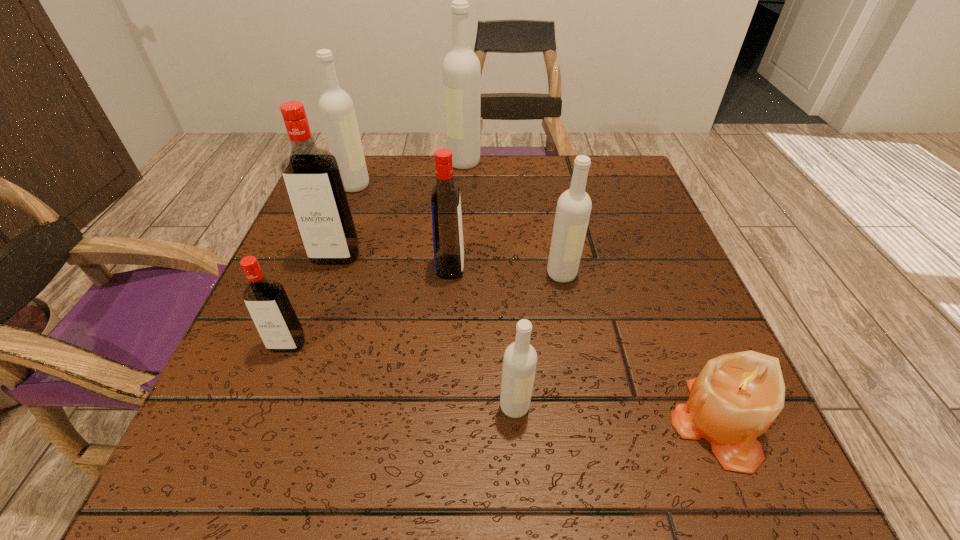
The width and height of the screenshot is (960, 540). Find the location of `empty space that is in between the tallest object and the rightmost object`. empty space that is in between the tallest object and the rightmost object is located at coordinates [x=590, y=292].

The width and height of the screenshot is (960, 540). What are the coordinates of `free space between the smallest white vodka and the third white vodka from right to left` in the screenshot? It's located at [x=490, y=285].

Identify which object is the second nearest to the rightmost white vodka. Please provide its 2D coordinates. Your answer should be formatted as a tuple, i.e. [(x, y)], where the tuple contains the x and y coordinates of a point satisfying the conditions above.

[(736, 397)]

I want to click on the sixth closest object to the sixth farthest object, so click(736, 397).

The width and height of the screenshot is (960, 540). Identify the location of vodka that is the closest to the nearest vodka. (573, 210).

This screenshot has width=960, height=540. I want to click on the third closest vodka to the third nearest white vodka, so click(x=448, y=245).

Identify the location of white vodka that is the nearest to the nearest white vodka. tap(573, 210).

Locate which white vodka is the second closest to the second smallest red vodka. Please provide its 2D coordinates. Your answer should be formatted as a tuple, i.e. [(x, y)], where the tuple contains the x and y coordinates of a point satisfying the conditions above.

[(520, 358)]

Locate an element on the screen. This screenshot has height=540, width=960. the third closest red vodka relative to the candle is located at coordinates (311, 175).

Identify the location of red vodka that can be found as the third closest to the rightmost vodka. This screenshot has width=960, height=540. (266, 300).